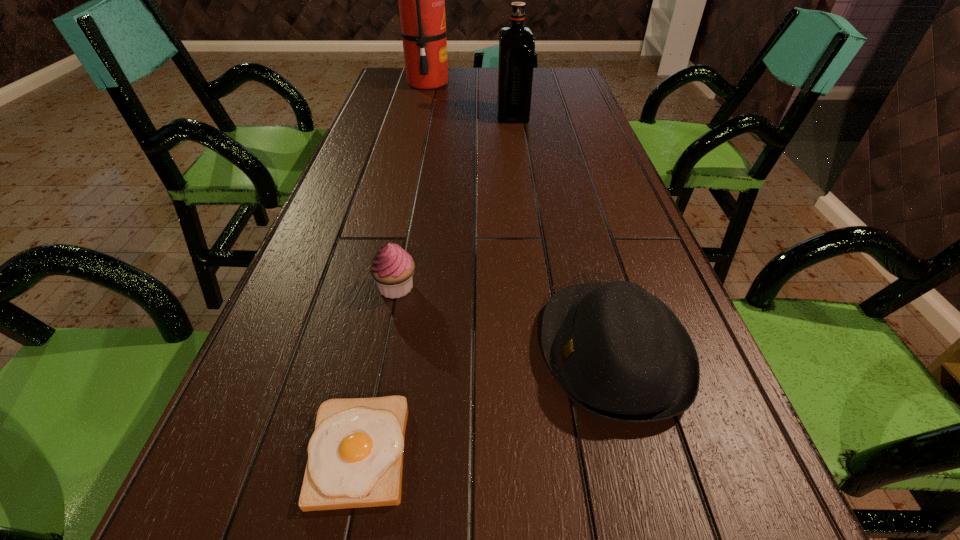
I want to click on free spot between the second tallest object and the cupcake, so click(455, 201).

The image size is (960, 540). What are the coordinates of `vacant space that's between the shortest object and the fourth shortest object` in the screenshot? It's located at (436, 284).

In order to click on unoccupied position between the cupcake and the fire extinguisher in this screenshot , I will do `click(412, 185)`.

Locate an element on the screen. The height and width of the screenshot is (540, 960). unoccupied area between the second tallest object and the fedora is located at coordinates (564, 233).

Locate which object is the closest to the shortest object. Please provide its 2D coordinates. Your answer should be formatted as a tuple, i.e. [(x, y)], where the tuple contains the x and y coordinates of a point satisfying the conditions above.

[(618, 352)]

Locate which object is the third closest to the tallest object. Please provide its 2D coordinates. Your answer should be formatted as a tuple, i.e. [(x, y)], where the tuple contains the x and y coordinates of a point satisfying the conditions above.

[(618, 352)]

Locate an element on the screen. This screenshot has width=960, height=540. vacant area in the image that satisfies the following two spatial constraints: 1. on the side of the fire extinguisher with the nozzle and handle; 2. on the left side of the cupcake is located at coordinates (379, 287).

This screenshot has width=960, height=540. I want to click on free point that satisfies the following two spatial constraints: 1. on the side of the cupcake with the nozzle and handle; 2. on the right side of the fire extinguisher, so click(379, 287).

You are a GUI agent. You are given a task and a screenshot of the screen. Output one action in this format:
    pyautogui.click(x=<x>, y=<y>)
    Task: Click on the free spot that satisfies the following two spatial constraints: 1. on the side of the shortest object with the nozzle and handle; 2. on the left side of the fire extinguisher
    Image resolution: width=960 pixels, height=540 pixels.
    Given the screenshot: What is the action you would take?
    pyautogui.click(x=340, y=451)

Locate an element on the screen. This screenshot has height=540, width=960. vacant space that satisfies the following two spatial constraints: 1. on the side of the cupcake with the nozzle and handle; 2. on the right side of the fire extinguisher is located at coordinates (379, 287).